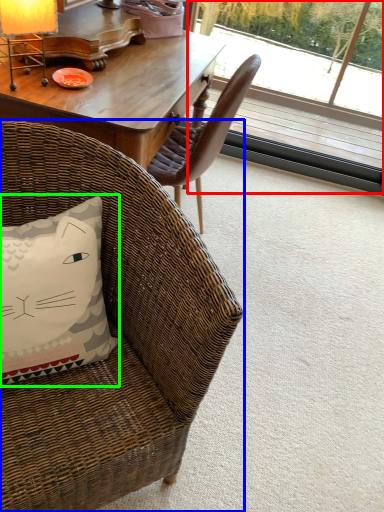
Question: Considering the real-world distances, which object is closest to window screen (highlighted by a red box)? chair (highlighted by a blue box) or pillow (highlighted by a green box).

Choices:
 (A) chair
 (B) pillow

Answer: (A)